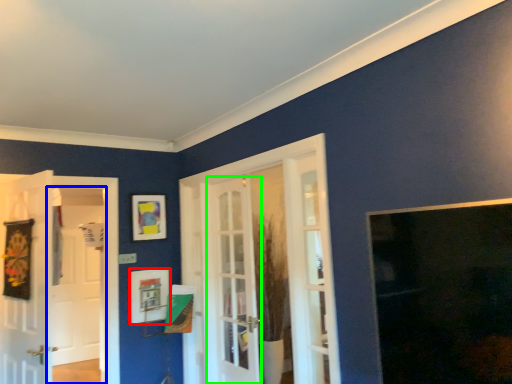
Question: Based on their relative distances, which object is nearer to picture frame (highlighted by a red box)? Choose from screen door (highlighted by a blue box) and door (highlighted by a green box).

Choices:
 (A) screen door
 (B) door

Answer: (B)